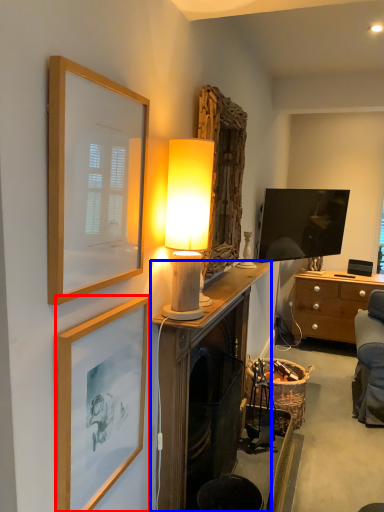
Question: Which object is closer to the camera taking this photo, picture frame (highlighted by a red box) or cabinetry (highlighted by a blue box)?

Choices:
 (A) picture frame
 (B) cabinetry

Answer: (A)